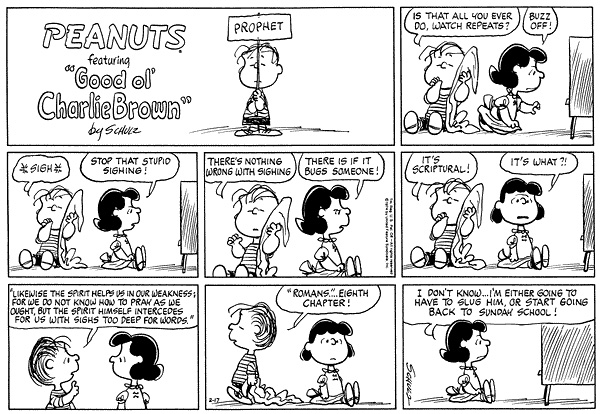
Locate an element on the screen. tv is located at coordinates (581, 77), (194, 221), (586, 224), (579, 357).